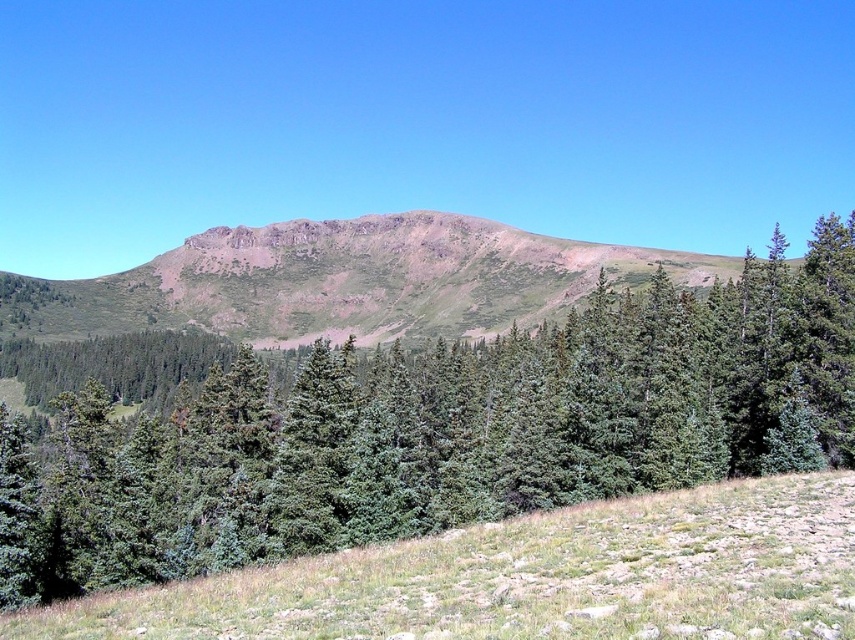
Is point (93, 627) in front of point (555, 305)?

That is True.

Who is more distant from viewer, (777, 573) or (337, 321)?

Point (337, 321)

Is point (823, 496) closer to viewer compared to point (272, 316)?

Yes, it is.

The height and width of the screenshot is (640, 855). In order to click on green grassy hillside at lower center in this screenshot , I will do `click(531, 577)`.

Between point (706, 433) and point (759, 602), which one is positioned behind?

The point (706, 433) is more distant.

Is point (345, 436) behind point (226, 625)?

Yes, point (345, 436) is behind point (226, 625).

Does point (481, 486) lie behind point (764, 493)?

Yes.

This screenshot has width=855, height=640. I want to click on green matte tree at center, so click(x=439, y=429).

Can you confirm if green matte tree at center is wider than rustic brown mountain at center?

No.

Who is positioned more to the right, green matte tree at center or rustic brown mountain at center?

green matte tree at center

Locate an element on the screen. The height and width of the screenshot is (640, 855). green matte tree at center is located at coordinates (439, 429).